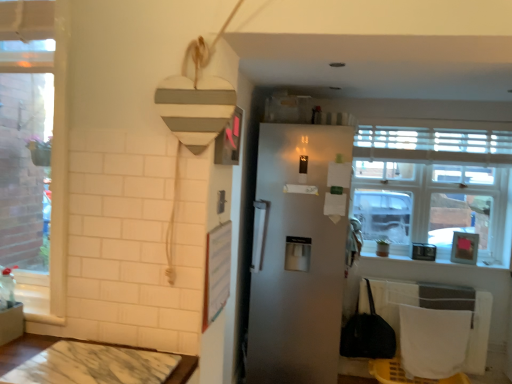
Question: In terms of height, does clear glass window at upper right look taller or shorter compared to marble table at lower left?

Choices:
 (A) short
 (B) tall

Answer: (B)

Question: Is clear glass window at upper right inside the boundaries of marble table at lower left, or outside?

Choices:
 (A) outside
 (B) inside

Answer: (A)

Question: Which object is positioned farthest from the clear glass window at upper right?

Choices:
 (A) satin white fridge at center
 (B) marble table at lower left

Answer: (B)

Question: Which object is positioned farthest from the marble table at lower left?

Choices:
 (A) satin white fridge at center
 (B) clear glass window at upper right

Answer: (B)